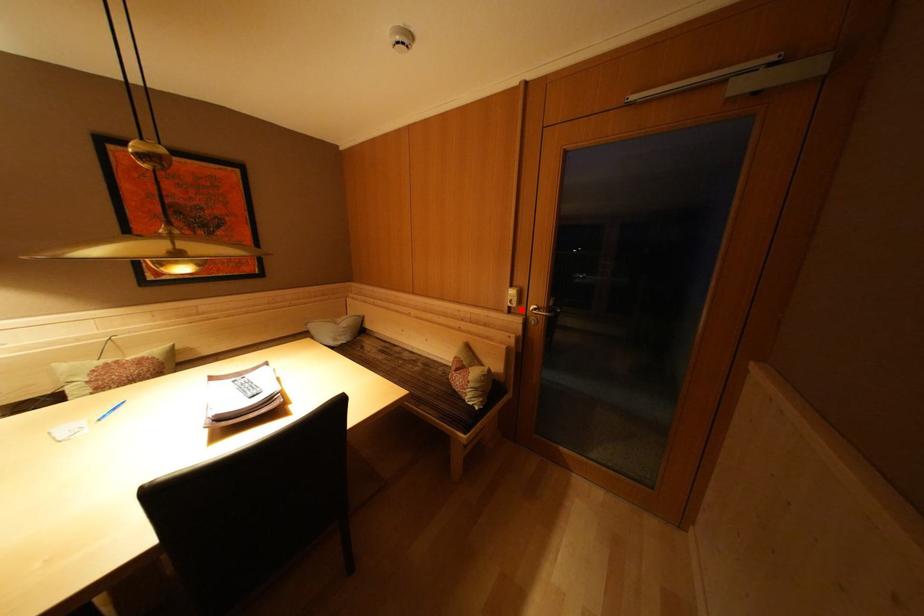
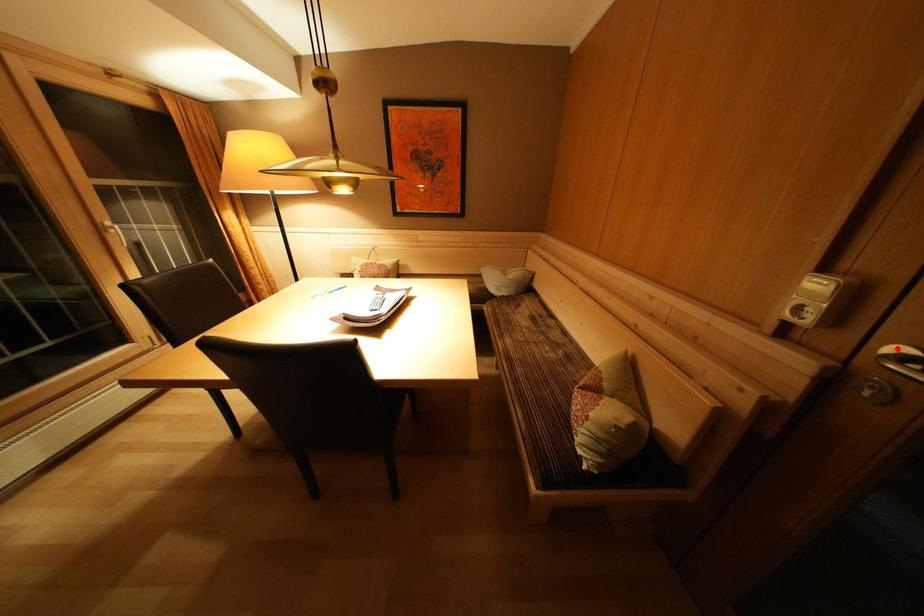
I am providing you with two images of the same scene from different viewpoints. A red point is marked on the first image and another point is marked on the second image. Are the points marked in image1 and image2 representing the same 3D position?

No